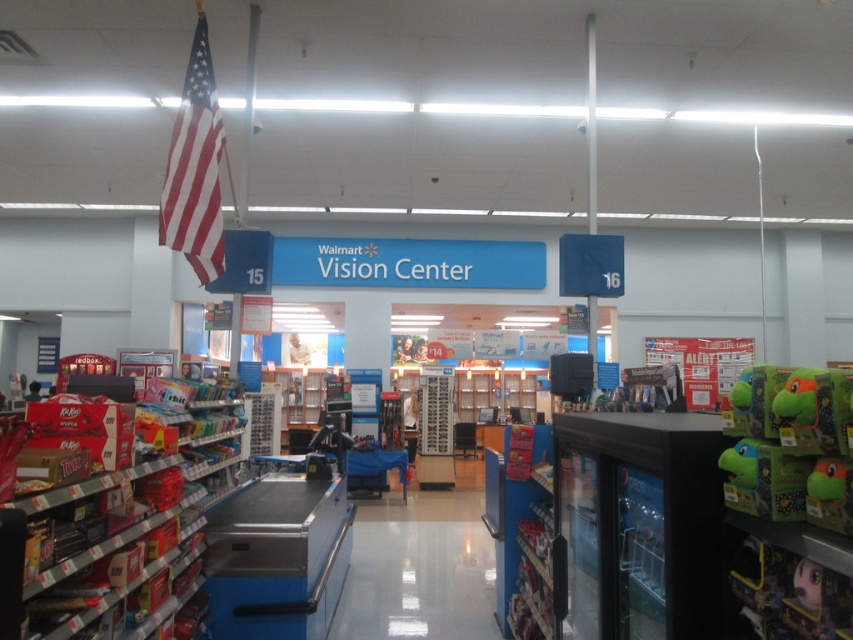
Question: Can you confirm if green plush toy at right is positioned below red-white striped flag at upper left?

Choices:
 (A) yes
 (B) no

Answer: (A)

Question: Which point is farther to the camera?

Choices:
 (A) red-white striped flag at upper left
 (B) green plush toy at right

Answer: (A)

Question: Which point is closer to the camera?

Choices:
 (A) (215, 131)
 (B) (793, 410)

Answer: (B)

Question: Which object appears farthest from the camera in this image?

Choices:
 (A) green plush toy at right
 (B) red-white striped flag at upper left

Answer: (B)

Question: Can you confirm if green plush toy at right is wider than red-white striped flag at upper left?

Choices:
 (A) no
 (B) yes

Answer: (A)

Question: Is green plush toy at right bigger than red-white striped flag at upper left?

Choices:
 (A) yes
 (B) no

Answer: (B)